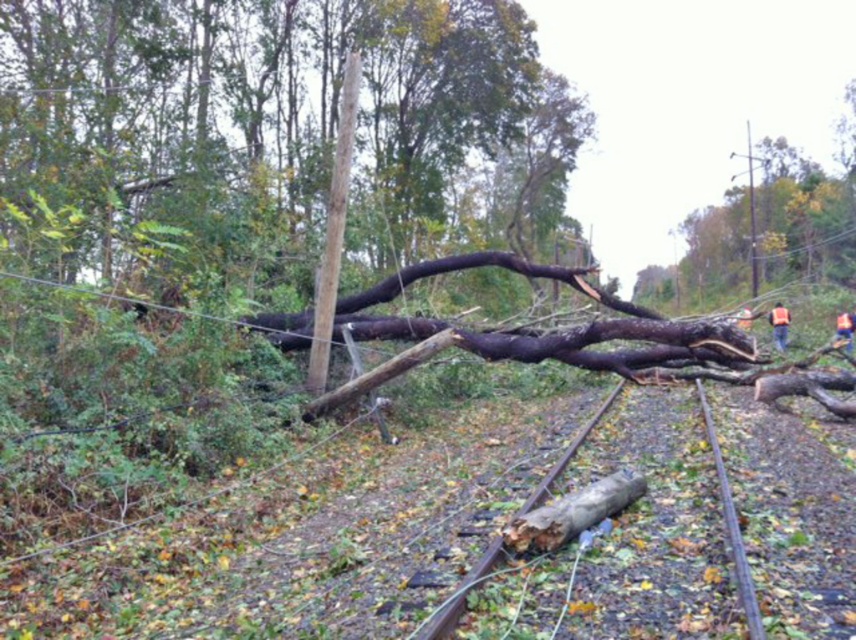
Question: Among these points, which one is farthest from the camera?

Choices:
 (A) (755, 596)
 (B) (525, 538)
 (C) (779, 332)

Answer: (C)

Question: Is brown wood log at center smaller than brown rough log at lower center?

Choices:
 (A) no
 (B) yes

Answer: (A)

Question: Is brown rough log at lower center bigger than orange reflective vest at right?

Choices:
 (A) no
 (B) yes

Answer: (A)

Question: Among these objects, which one is farthest from the camera?

Choices:
 (A) orange reflective vest at right
 (B) brown rough log at lower center

Answer: (A)

Question: Which object appears closest to the camera in this image?

Choices:
 (A) brown wood log at center
 (B) orange reflective vest at right

Answer: (A)

Question: Is brown wood log at center bigger than brown rough log at lower center?

Choices:
 (A) yes
 (B) no

Answer: (A)